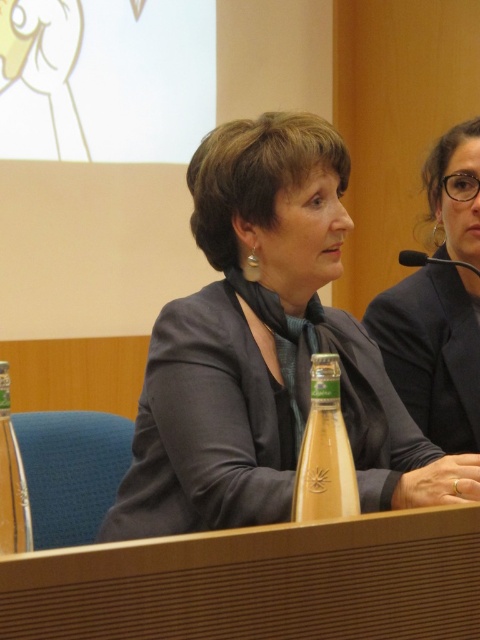
In the scene shown: You are organizing a small event and need to determine seating arrangements. There are two items at the center of the table in the image. One is the matte gray blazer at center and the other is the wooden at center. Which item takes up more space on the table?

The matte gray blazer at center has a larger size compared to wooden at center, so it takes up more space on the table.

You are a conference attendee who needs to grab the clear glass bottle at left quickly. The matte gray blazer at center is blocking your path. Can you reach the bottle without moving the blazer?

The matte gray blazer at center and clear glass bottle at left are 18.65 inches apart, so yes, you can reach the clear glass bottle at left without moving the matte gray blazer at center since the distance between them allows for easy access.